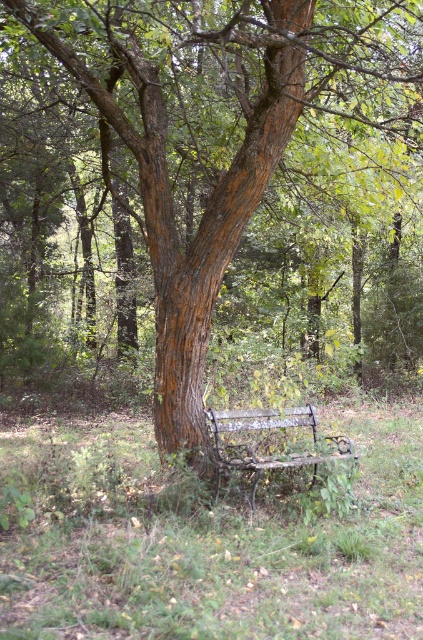
You are a gardener who wants to mow the green grass at lower center. However, you need to avoid damaging the rusty metal bench at center. Based on the scene, can you determine if the grass is shorter than the bench?

The green grass at lower center has a lesser height compared to the rusty metal bench at center, so yes, the grass is shorter than the bench. You can safely mow the green grass at lower center without damaging the bench.

You are standing at the point marked as point (x=209, y=541) in the image. What object is directly under your feet?

The green grass at lower center is located at point (x=209, y=541), so the object directly under your feet is the green grass at lower center.